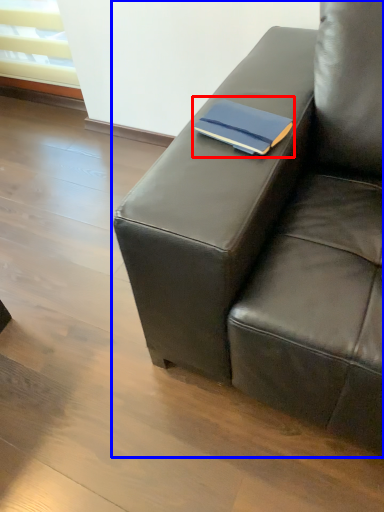
Question: Among these objects, which one is nearest to the camera, paperback book (highlighted by a red box) or studio couch (highlighted by a blue box)?

Choices:
 (A) paperback book
 (B) studio couch

Answer: (B)